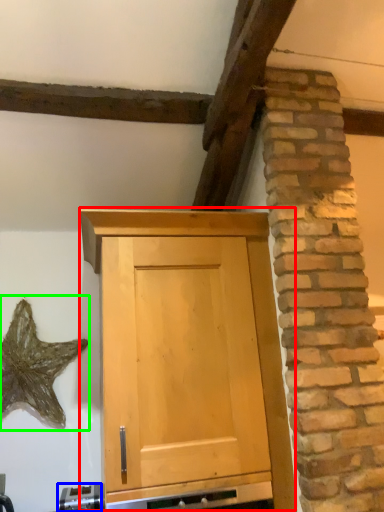
Question: Which is farther away from cupboard (highlighted by a red box)? appliance (highlighted by a blue box) or star (highlighted by a green box)?

Choices:
 (A) appliance
 (B) star

Answer: (B)